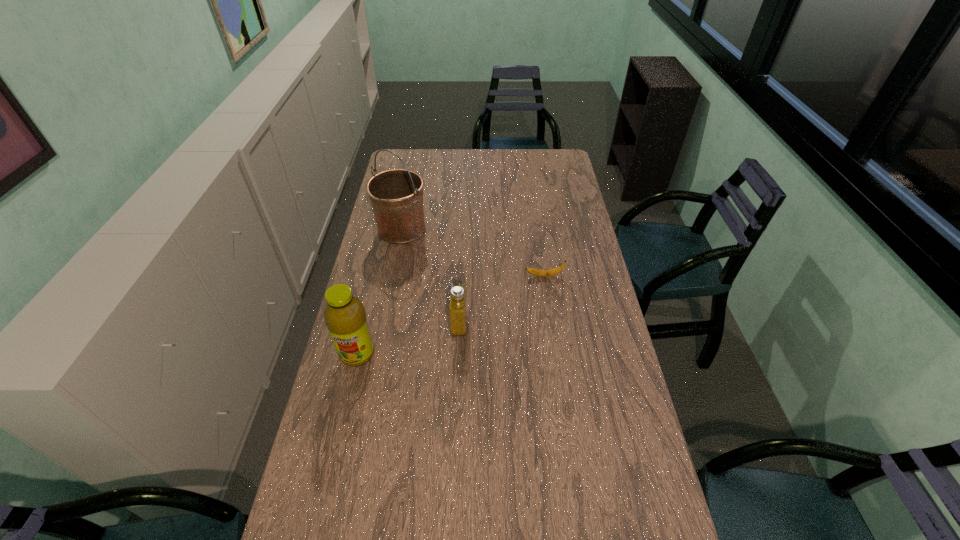
The width and height of the screenshot is (960, 540). In order to click on bucket in this screenshot , I will do `click(396, 195)`.

Locate an element on the screen. Image resolution: width=960 pixels, height=540 pixels. the tallest object is located at coordinates (396, 195).

Find the location of a particular element. the second tallest object is located at coordinates (345, 316).

Where is `fruit juice`? This screenshot has width=960, height=540. fruit juice is located at coordinates [x=345, y=316].

Where is `the third farthest object`? This screenshot has width=960, height=540. the third farthest object is located at coordinates (458, 296).

Find the location of a particular element. The width and height of the screenshot is (960, 540). the second shortest object is located at coordinates (458, 296).

Locate an element on the screen. the shortest object is located at coordinates (538, 272).

The height and width of the screenshot is (540, 960). Find the location of `banana`. banana is located at coordinates (538, 272).

The image size is (960, 540). Identify the location of vacant space positioned 0.400m on the back of the farthest object. (415, 165).

Find the location of `free space located on the front label of the fruit juice`. free space located on the front label of the fruit juice is located at coordinates (343, 414).